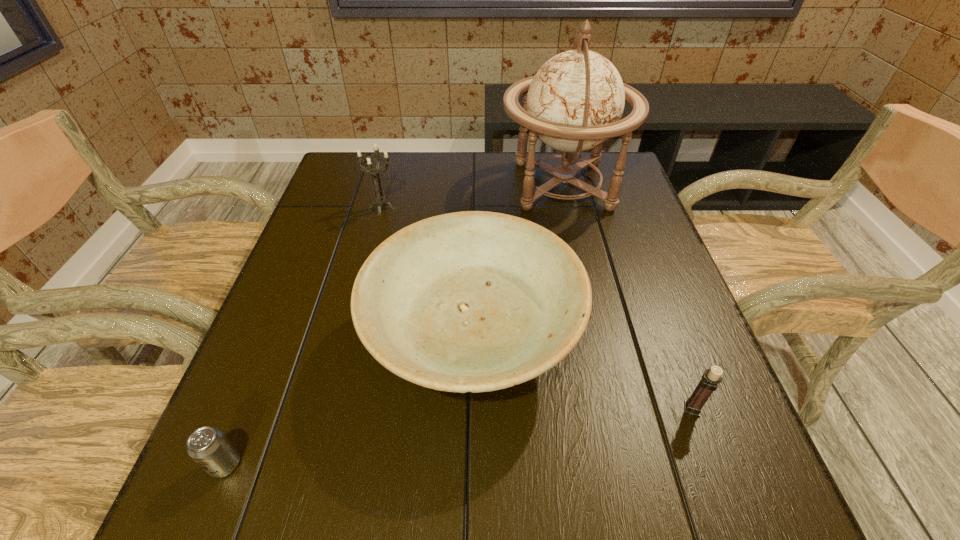
Locate an element on the screen. empty location between the taller candle holder and the nearest object is located at coordinates (303, 336).

Where is `free spot between the globe and the shorter candle holder`? free spot between the globe and the shorter candle holder is located at coordinates (627, 297).

The image size is (960, 540). I want to click on vacant region between the right candle holder and the dish, so click(582, 375).

The width and height of the screenshot is (960, 540). I want to click on vacant region between the nearer candle holder and the globe, so click(x=627, y=297).

At what (x,y) coordinates should I click in order to perform the action: click on object that is the second closest one to the dish. Please return your answer as a coordinate pair (x, y). Looking at the image, I should click on (710, 379).

Locate which object ranks in proximity to the tallest object. Please provide its 2D coordinates. Your answer should be formatted as a tuple, i.e. [(x, y)], where the tuple contains the x and y coordinates of a point satisfying the conditions above.

[(474, 301)]

Find the location of `free space that satisfies the following two spatial constraints: 1. at the front of the globe showing Africa; 2. on the front side of the left candle holder`. free space that satisfies the following two spatial constraints: 1. at the front of the globe showing Africa; 2. on the front side of the left candle holder is located at coordinates (567, 207).

At what (x,y) coordinates should I click in order to perform the action: click on free space that satisfies the following two spatial constraints: 1. on the front side of the dish; 2. on the left side of the right candle holder. Please return your answer as a coordinate pair (x, y). This screenshot has height=540, width=960. Looking at the image, I should click on (471, 409).

Find the location of a particular element. vacant space that satisfies the following two spatial constraints: 1. on the back side of the right candle holder; 2. at the front of the tallest object showing Africa is located at coordinates (610, 185).